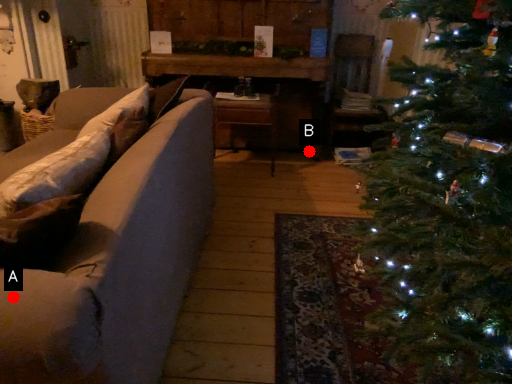
Question: Two points are circled on the image, labeled by A and B beside each circle. Which of the following is the closest to the observer?

Choices:
 (A) A is closer
 (B) B is closer

Answer: (A)